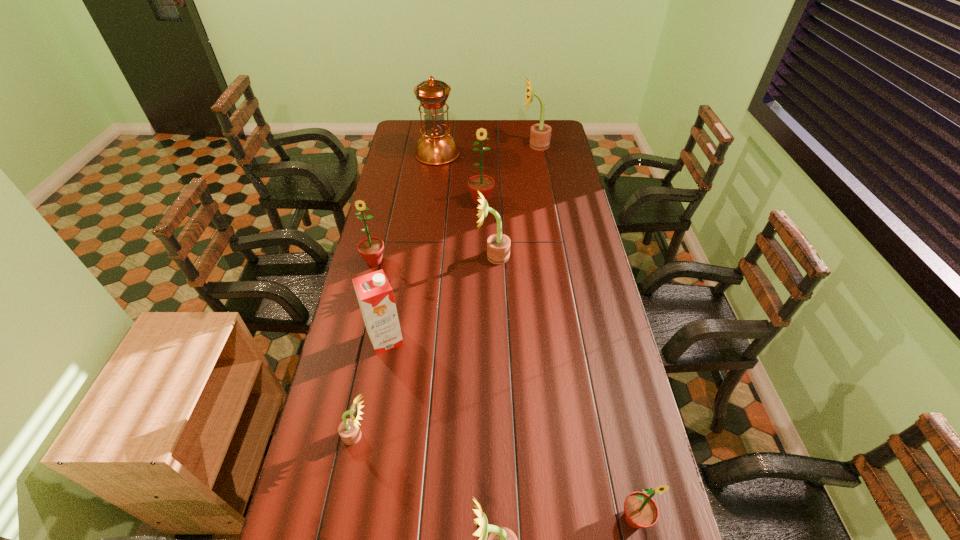
Image resolution: width=960 pixels, height=540 pixels. I want to click on free space located 0.070m on the face of the second farthest yellow sunflower, so click(459, 256).

In order to click on vacant space located on the face of the second farthest green sunflower in this screenshot , I will do `click(353, 347)`.

Locate an element on the screen. The height and width of the screenshot is (540, 960). vacant region located on the right of the carton is located at coordinates (468, 339).

The height and width of the screenshot is (540, 960). I want to click on vacant space located 0.230m on the face of the leftmost yellow sunflower, so click(453, 436).

This screenshot has width=960, height=540. I want to click on object positioned at the far edge, so click(x=540, y=134).

I want to click on oil lamp that is at the left edge, so click(435, 147).

Where is `carton that is at the left edge`? The height and width of the screenshot is (540, 960). carton that is at the left edge is located at coordinates (375, 295).

I want to click on object that is at the far right corner, so click(x=540, y=134).

You are a GUI agent. You are given a task and a screenshot of the screen. Output one action in this format:
    pyautogui.click(x=<x>, y=<y>)
    Task: Click on the free space at the far edge
    This screenshot has width=960, height=540.
    Given the screenshot: What is the action you would take?
    pos(465,136)

In the image, there is a desktop. Identify the location of free space at the left edge. Image resolution: width=960 pixels, height=540 pixels. (401, 178).